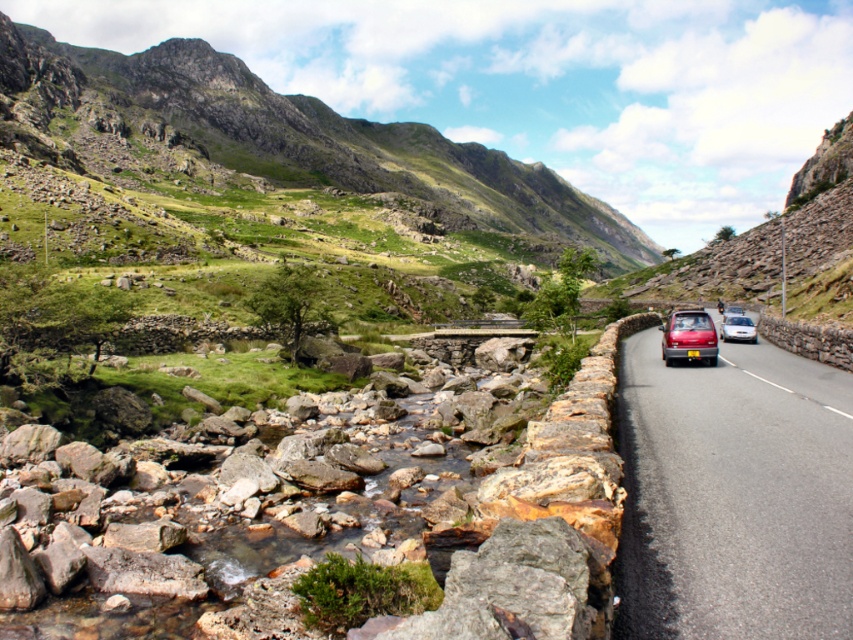
Between matte red car at right and satin silver sedan at right, which one has more height?

matte red car at right

Measure the distance between matte red car at right and camera.

A distance of 91.06 feet exists between matte red car at right and camera.

What do you see at coordinates (689, 337) in the screenshot? I see `matte red car at right` at bounding box center [689, 337].

Locate an element on the screen. matte red car at right is located at coordinates (689, 337).

Between green grassy mountain at upper center and matte red car at right, which one appears on the right side from the viewer's perspective?

matte red car at right is more to the right.

Based on the photo, who is lower down, green grassy mountain at upper center or matte red car at right?

matte red car at right is lower down.

Does point (515, 180) come in front of point (672, 364)?

No, it is behind (672, 364).

In order to click on green grassy mountain at upper center in this screenshot , I will do `click(305, 138)`.

Locate an element on the screen. The image size is (853, 640). green grassy mountain at upper center is located at coordinates (305, 138).

Which is in front, point (570, 240) or point (746, 333)?

Point (746, 333) is in front.

Who is more forward, (138, 65) or (746, 326)?

Point (746, 326) is more forward.

You are a GUI agent. You are given a task and a screenshot of the screen. Output one action in this format:
    pyautogui.click(x=<x>, y=<y>)
    Task: Click on the green grassy mountain at upper center
    Image resolution: width=853 pixels, height=640 pixels.
    Given the screenshot: What is the action you would take?
    pyautogui.click(x=305, y=138)